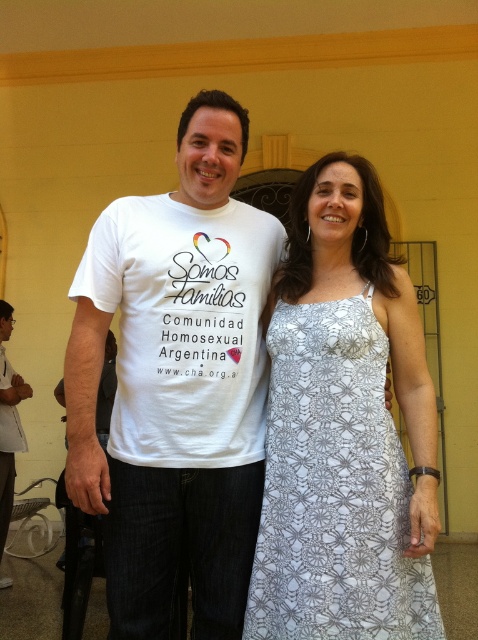
Question: Observing the image, what is the correct spatial positioning of white printed t-shirt at center in reference to white matte t-shirt at center?

Choices:
 (A) above
 (B) below

Answer: (A)

Question: Which point is closer to the camera taking this photo?

Choices:
 (A) (267, 621)
 (B) (243, 344)

Answer: (A)

Question: Which object appears closest to the camera in this image?

Choices:
 (A) white cotton t-shirt at center
 (B) white matte t-shirt at center

Answer: (A)

Question: Does white printed t-shirt at center appear under white lace dress at center?

Choices:
 (A) no
 (B) yes

Answer: (A)

Question: From the image, what is the correct spatial relationship of white printed t-shirt at center in relation to white cotton t-shirt at center?

Choices:
 (A) above
 (B) below

Answer: (B)

Question: Which point appears farthest from the camera in this image?

Choices:
 (A) (360, 499)
 (B) (401, 445)
 (C) (0, 500)
 (D) (235, 220)

Answer: (C)